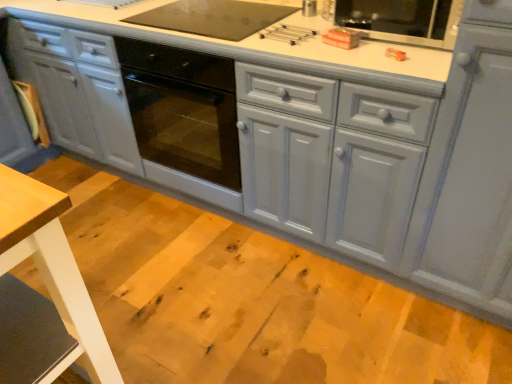
In order to face light brown wood table at lower left, should I rotate leftwards or rightwards?

Rotate left and turn 32.501 degrees.

Describe the element at coordinates (52, 269) in the screenshot. I see `light brown wood table at lower left` at that location.

I want to click on light brown wood table at lower left, so click(x=52, y=269).

Where is `matte gray cabinet at right`? The image size is (512, 384). matte gray cabinet at right is located at coordinates (469, 171).

What do you see at coordinates (469, 171) in the screenshot? I see `matte gray cabinet at right` at bounding box center [469, 171].

The image size is (512, 384). What are the coordinates of `light brown wood table at lower left` in the screenshot? It's located at (52, 269).

Would you say matte gray cabinet at right is to the left or to the right of light brown wood table at lower left in the picture?

Clearly, matte gray cabinet at right is on the right of light brown wood table at lower left in the image.

Is matte gray cabinet at right positioned in front of light brown wood table at lower left?

That is False.

Between point (453, 217) and point (118, 374), which one is positioned behind?

Point (453, 217)

From the image's perspective, between matte gray cabinet at right and light brown wood table at lower left, who is located below?

light brown wood table at lower left is shown below in the image.

From a real-world perspective, which object rests below the other?

In real-world perspective, light brown wood table at lower left is lower.

In terms of width, does matte gray cabinet at right look wider or thinner when compared to light brown wood table at lower left?

Considering their sizes, matte gray cabinet at right looks broader than light brown wood table at lower left.

From their relative heights in the image, would you say matte gray cabinet at right is taller or shorter than light brown wood table at lower left?

Considering their sizes, matte gray cabinet at right has more height than light brown wood table at lower left.

Consider the image. Based on their sizes in the image, would you say matte gray cabinet at right is bigger or smaller than light brown wood table at lower left?

In the image, matte gray cabinet at right appears to be larger than light brown wood table at lower left.

Which is correct: matte gray cabinet at right is inside light brown wood table at lower left, or outside of it?

matte gray cabinet at right is not enclosed by light brown wood table at lower left.

Is matte gray cabinet at right beside light brown wood table at lower left?

They are not placed beside each other.

Is matte gray cabinet at right positioned with its back to light brown wood table at lower left?

That's not correct — matte gray cabinet at right is not looking away from light brown wood table at lower left.

Find the location of a particular element. cabinetry that is above the light brown wood table at lower left (from the image's perspective) is located at coordinates (469, 171).

In the image, is light brown wood table at lower left on the left side or the right side of matte gray cabinet at right?

light brown wood table at lower left is positioned on matte gray cabinet at right's left side.

Does light brown wood table at lower left lie behind matte gray cabinet at right?

No, light brown wood table at lower left is in front of matte gray cabinet at right.

Does point (37, 210) appear closer or farther from the camera than point (508, 231)?

Point (37, 210) is closer to the camera than point (508, 231).

From the image's perspective, is light brown wood table at lower left positioned above or below matte gray cabinet at right?

Based on their image positions, light brown wood table at lower left is located beneath matte gray cabinet at right.

From a real-world perspective, which is physically above, light brown wood table at lower left or matte gray cabinet at right?

From a 3D spatial view, matte gray cabinet at right is above.

Considering the sizes of objects light brown wood table at lower left and matte gray cabinet at right in the image provided, who is wider, light brown wood table at lower left or matte gray cabinet at right?

With larger width is matte gray cabinet at right.

Between light brown wood table at lower left and matte gray cabinet at right, which one has more height?

Standing taller between the two is matte gray cabinet at right.

Does light brown wood table at lower left have a larger size compared to matte gray cabinet at right?

No, light brown wood table at lower left is not bigger than matte gray cabinet at right.

Is light brown wood table at lower left positioned beyond the bounds of matte gray cabinet at right?

Yes, light brown wood table at lower left is outside of matte gray cabinet at right.

Is the surface of light brown wood table at lower left in direct contact with matte gray cabinet at right?

light brown wood table at lower left and matte gray cabinet at right are clearly separated.

Looking at this image, is light brown wood table at lower left facing towards matte gray cabinet at right?

No, light brown wood table at lower left is not facing towards matte gray cabinet at right.

Consider the image. How many degrees apart are the facing directions of light brown wood table at lower left and matte gray cabinet at right?

The angular difference between light brown wood table at lower left and matte gray cabinet at right is 0.806 degrees.

Measure the distance from light brown wood table at lower left to matte gray cabinet at right.

1.08 meters.

You are a GUI agent. You are given a task and a screenshot of the screen. Output one action in this format:
    pyautogui.click(x=<x>, y=<y>)
    Task: Click on the cabinetry above the light brown wood table at lower left (from the image's perspective)
    This screenshot has height=384, width=512.
    Given the screenshot: What is the action you would take?
    pyautogui.click(x=469, y=171)

Locate an element on the screen. Image resolution: width=512 pixels, height=384 pixels. table lying below the matte gray cabinet at right (from the image's perspective) is located at coordinates (52, 269).

At what (x,y) coordinates should I click in order to perform the action: click on cabinetry that appears above the light brown wood table at lower left (from a real-world perspective). Please return your answer as a coordinate pair (x, y). The width and height of the screenshot is (512, 384). Looking at the image, I should click on (469, 171).